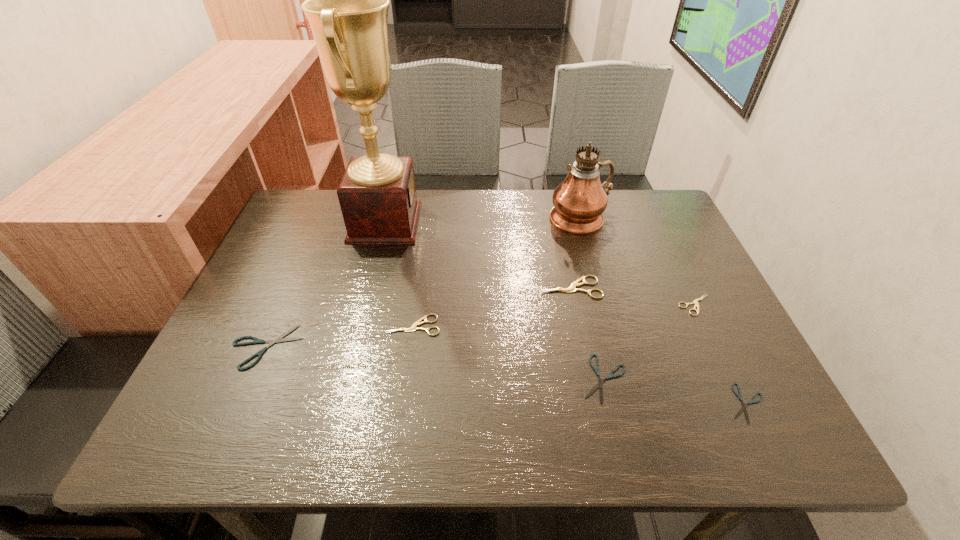
I want to click on vacant space that satisfies the following two spatial constraints: 1. on the front side of the shortest shears; 2. on the right side of the second smallest black shears, so click(611, 403).

At what (x,y) coordinates should I click in order to perform the action: click on free space that satisfies the following two spatial constraints: 1. on the plaque of the trophy cup; 2. on the right side of the second black shears from right to left. Please return your answer as a coordinate pair (x, y). This screenshot has width=960, height=540. Looking at the image, I should click on (346, 379).

I want to click on free space that satisfies the following two spatial constraints: 1. on the plaque of the trophy cup; 2. on the back side of the rightmost beige shears, so click(365, 305).